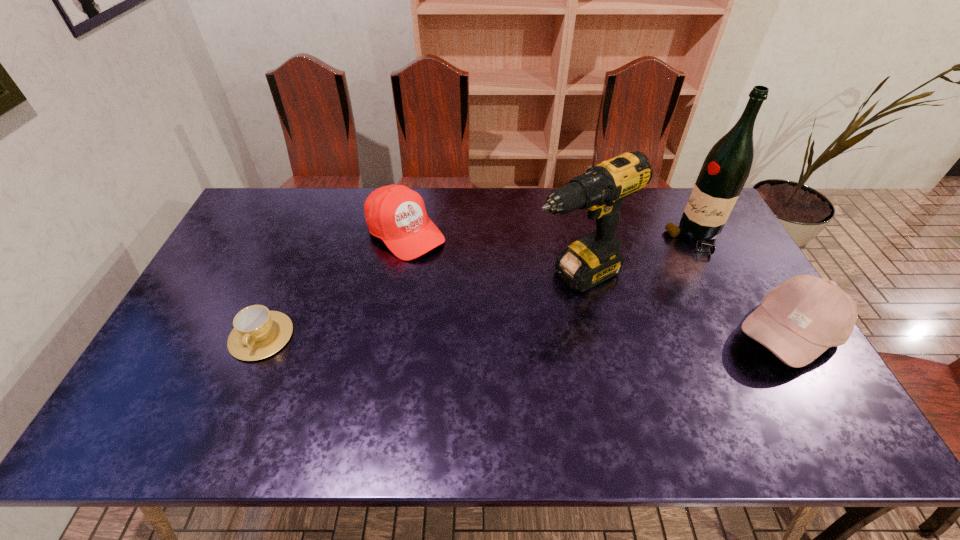
Identify the location of object situated at the left edge. (258, 333).

I want to click on baseball cap present at the right edge, so click(800, 319).

This screenshot has height=540, width=960. I want to click on wine bottle present at the right edge, so click(x=726, y=168).

Identify the location of object situated at the far right corner. The image size is (960, 540). (726, 168).

The height and width of the screenshot is (540, 960). I want to click on object present at the near right corner, so click(x=800, y=319).

This screenshot has width=960, height=540. What are the coordinates of `free space at the far edge of the desktop` in the screenshot? It's located at (417, 188).

I want to click on blank area at the near edge, so click(344, 399).

Where is `vacant space at the left edge of the desktop`? vacant space at the left edge of the desktop is located at coordinates (248, 232).

I want to click on vacant space at the right edge of the desktop, so click(699, 275).

You are a GUI agent. You are given a task and a screenshot of the screen. Output one action in this format:
    pyautogui.click(x=<x>, y=<y>)
    Task: Click on the vacant area at the near left corner of the desktop
    The image size is (960, 540).
    Given the screenshot: What is the action you would take?
    pyautogui.click(x=185, y=378)